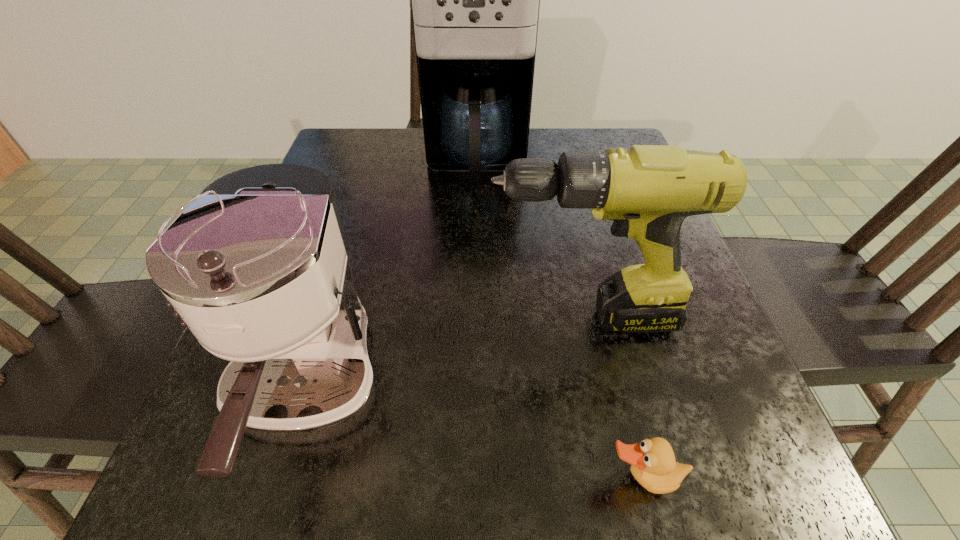
Where is `vacant region between the right coffee maker and the shorter coffee maker`? Image resolution: width=960 pixels, height=540 pixels. vacant region between the right coffee maker and the shorter coffee maker is located at coordinates (392, 278).

The height and width of the screenshot is (540, 960). I want to click on vacant space that's between the right coffee maker and the shortest object, so click(560, 322).

You are a GUI agent. You are given a task and a screenshot of the screen. Output one action in this format:
    pyautogui.click(x=<x>, y=<y>)
    Task: Click on the free space between the nearer coffee maker and the taller coffee maker
    Image resolution: width=960 pixels, height=540 pixels.
    Given the screenshot: What is the action you would take?
    pyautogui.click(x=392, y=278)

Where is `object that can be found as the third closest to the shorter coffee maker`? This screenshot has height=540, width=960. object that can be found as the third closest to the shorter coffee maker is located at coordinates (653, 465).

Locate which object ranks in proximity to the shortest object. Please provide its 2D coordinates. Your answer should be formatted as a tuple, i.e. [(x, y)], where the tuple contains the x and y coordinates of a point satisfying the conditions above.

[(647, 191)]

Image resolution: width=960 pixels, height=540 pixels. I want to click on blank area in the image that satisfies the following two spatial constraints: 1. on the handle side of the drill; 2. on the front-facing side of the nearer coffee maker, so click(597, 390).

I want to click on vacant space that satisfies the following two spatial constraints: 1. on the handle side of the drill; 2. on the front-facing side of the shorter coffee maker, so click(597, 390).